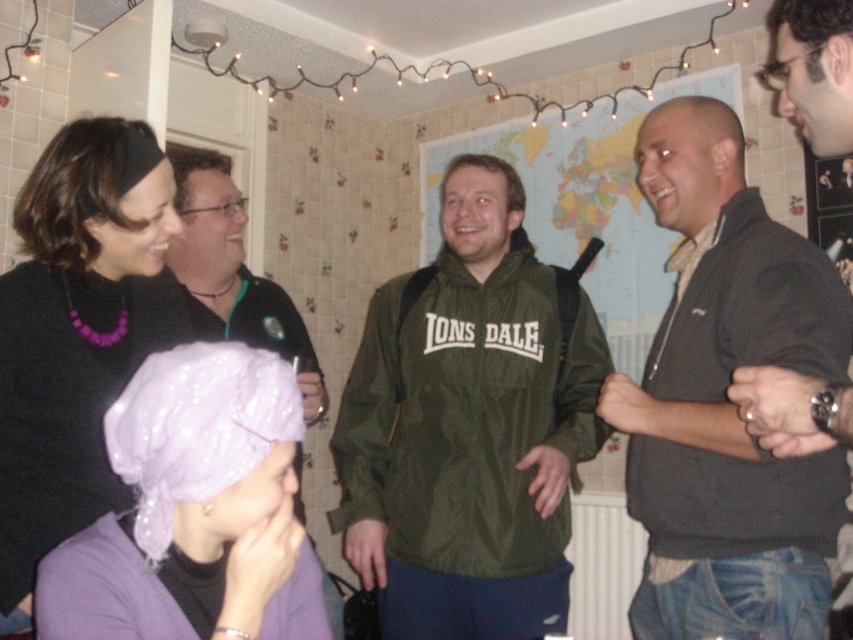
You are a photographer at the event and want to capture a photo of the dark gray sweater at center and the purple outfit woman. How far apart are they?

The dark gray sweater at center and the purple outfit woman are 4.23 feet apart.

You are at the center of the scene and want to take a photo of the point at coordinates point [437,323]. Is the point within your camera view? Assume your camera has a standard 50mm lens with a 46 degree diagonal field of view.

The point at coordinates point [437,323] is 6.18 feet away from the camera. With a standard 50mm lens and a 46 degree diagonal field of view, the camera can capture objects within this distance and angle, so the point should be within the camera view.

What is located at the coordinates point (726, 397)?

The dark gray sweater at center is located at point (726, 397).